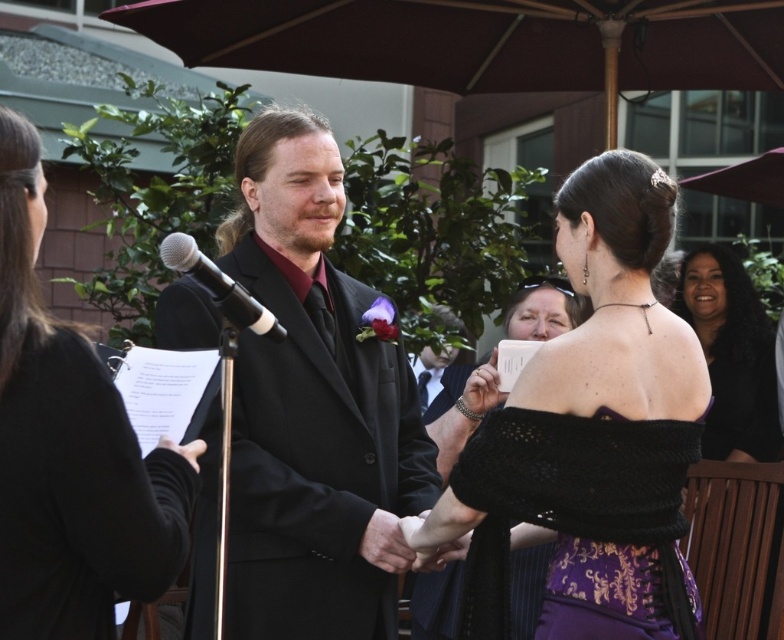
Question: Is matte black suit at center wider than black fabric dress at center?

Choices:
 (A) yes
 (B) no

Answer: (A)

Question: Which point is closer to the camera?

Choices:
 (A) (303, 218)
 (B) (588, 516)
 (C) (164, 250)

Answer: (C)

Question: Which point appears closest to the camera in this image?

Choices:
 (A) (636, 417)
 (B) (478, 381)
 (C) (728, 426)

Answer: (A)

Question: Can you confirm if purple satin dress at center is smaller than black lace dress at center?

Choices:
 (A) yes
 (B) no

Answer: (B)

Question: Is purple satin dress at center bigger than black fabric dress at center?

Choices:
 (A) yes
 (B) no

Answer: (A)

Question: Which point is closer to the camera?

Choices:
 (A) (737, 308)
 (B) (434, 376)

Answer: (A)